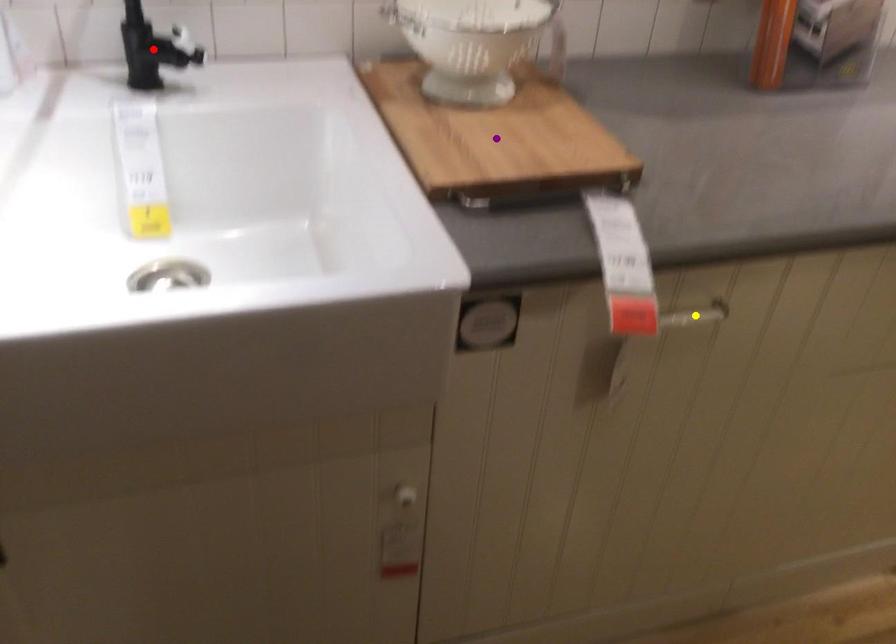
Order these from nearest to farthest:
purple point | yellow point | red point

red point
purple point
yellow point